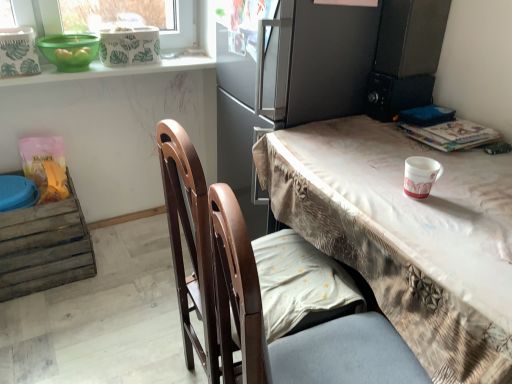
Locate an element on the screen. free spot behind white paper cup at right is located at coordinates pos(393,169).